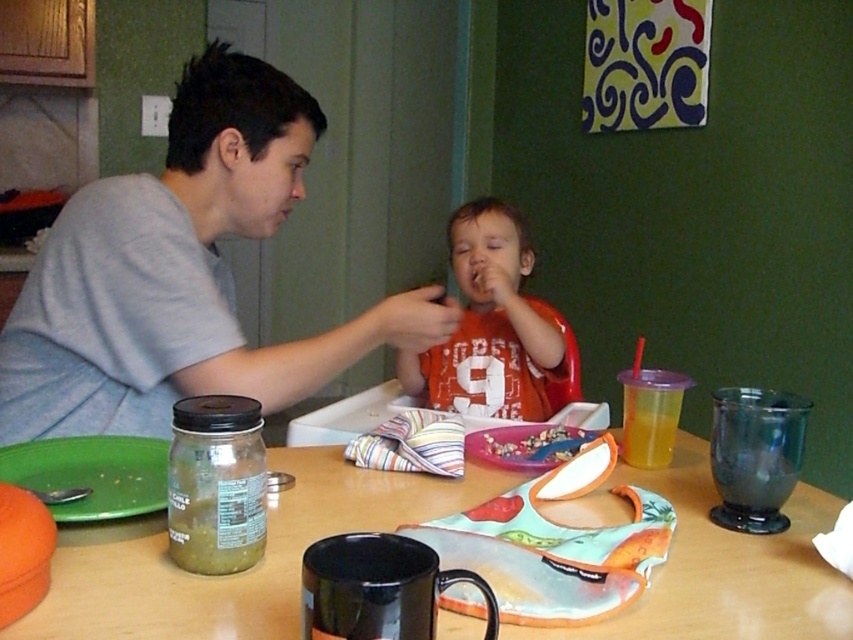
Question: Considering the real-world distances, which object is farthest from the wooden table at center?

Choices:
 (A) matte orange bib at center
 (B) green plastic plate at lower left
 (C) gray matte shirt at upper left

Answer: (A)

Question: Does green plastic plate at lower left lie behind purple plastic tray at center?

Choices:
 (A) yes
 (B) no

Answer: (B)

Question: Can you confirm if gray matte shirt at upper left is positioned to the right of crumbly brown cereal at center?

Choices:
 (A) no
 (B) yes

Answer: (A)

Question: Which of the following is the closest to the observer?

Choices:
 (A) purple plastic tray at center
 (B) matte orange bib at center
 (C) green plastic plate at lower left

Answer: (C)

Question: Estimate the real-world distances between objects in this image. Which object is farther from the gray matte shirt at upper left?

Choices:
 (A) matte orange bib at center
 (B) green plastic plate at lower left
 (C) purple plastic tray at center

Answer: (C)

Question: Does gray matte shirt at upper left have a larger size compared to purple plastic tray at center?

Choices:
 (A) yes
 (B) no

Answer: (A)